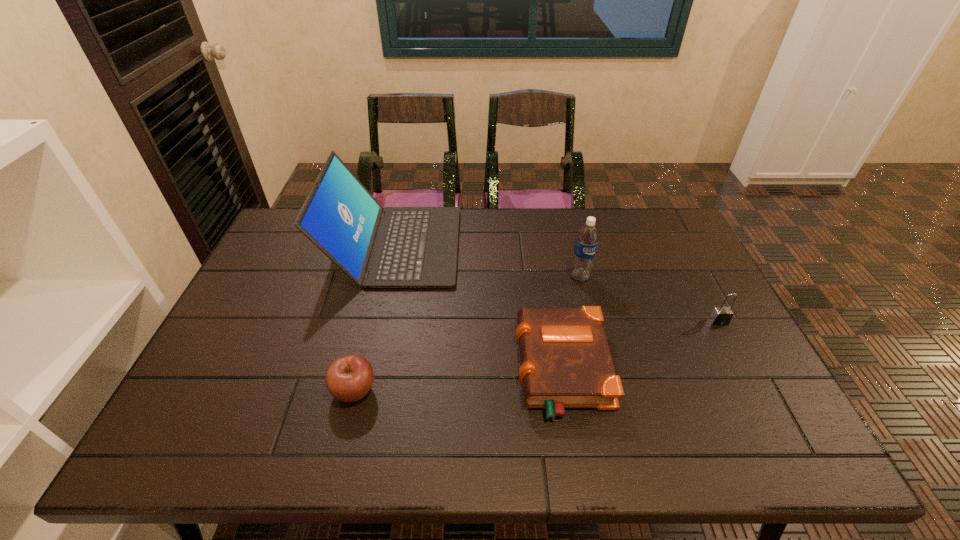
I want to click on unoccupied position between the shortest object and the apple, so click(458, 380).

Locate an element on the screen. free point between the apple and the laptop computer is located at coordinates (374, 318).

Locate an element on the screen. The width and height of the screenshot is (960, 540). free point between the laptop computer and the water bottle is located at coordinates (488, 261).

The image size is (960, 540). What are the coordinates of `free space between the apple and the shortest object` in the screenshot? It's located at (458, 380).

Identify the location of free space between the Bible and the rightmost object. The height and width of the screenshot is (540, 960). (640, 345).

Find the location of a particular element. The width and height of the screenshot is (960, 540). free spot between the water bottle and the padlock is located at coordinates (649, 299).

At what (x,y) coordinates should I click in order to perform the action: click on vacant point located between the padlock and the water bottle. Please return your answer as a coordinate pair (x, y). The image size is (960, 540). Looking at the image, I should click on (649, 299).

Choose which object is the fourth nearest neighbor to the Bible. Please provide its 2D coordinates. Your answer should be formatted as a tuple, i.e. [(x, y)], where the tuple contains the x and y coordinates of a point satisfying the conditions above.

[(349, 378)]

This screenshot has width=960, height=540. What are the coordinates of `the second closest object relative to the Bible` in the screenshot? It's located at (392, 247).

In order to click on free spot that satisfies the following two spatial constraints: 1. on the shackle of the rightmost object; 2. on the spine side of the Bible in this screenshot , I will do `click(744, 369)`.